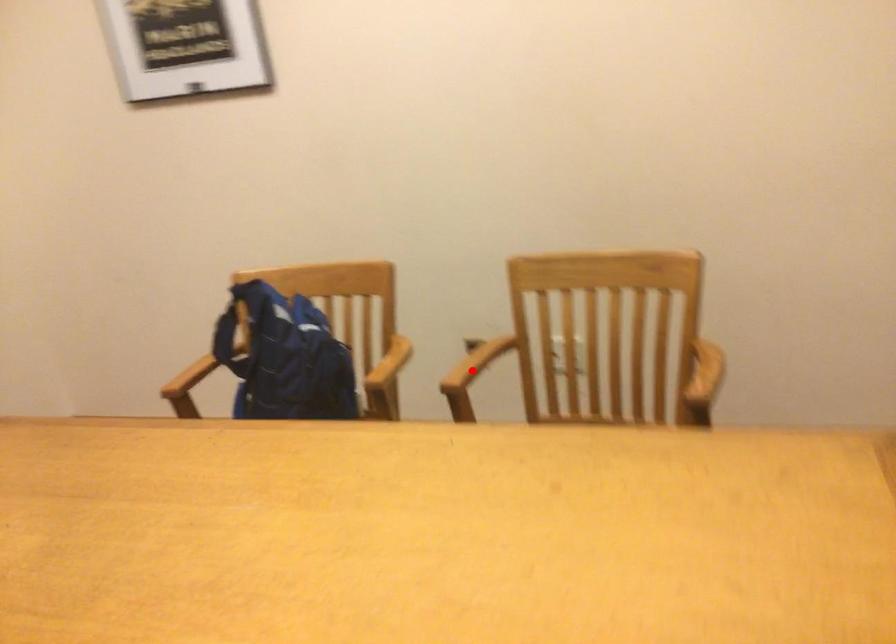
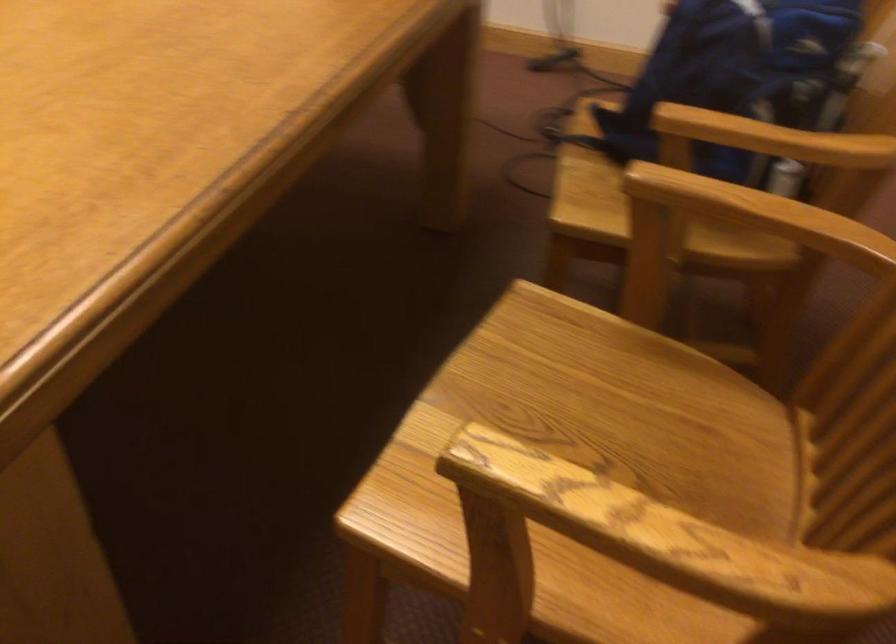
Question: I am providing you with two images of the same scene from different viewpoints. Given a red point in image1, look at the same physical point in image2. Is it:

Choices:
 (A) Closer to the viewpoint
 (B) Farther from the viewpoint

Answer: (A)